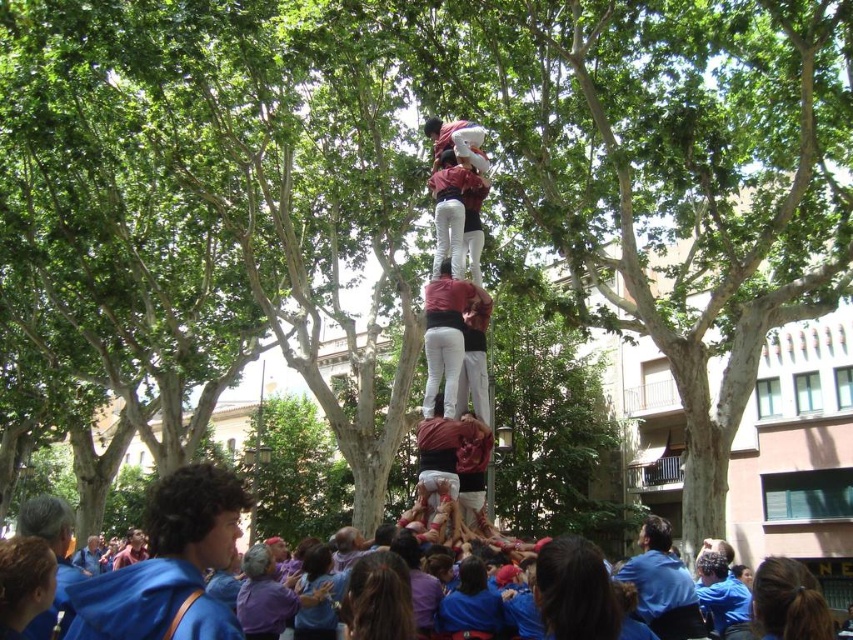
You are an event photographer at the base of the human tower. You need to capture a clear photo of both the smooth white pants at center and the matte red shirt at center. Which object will appear larger in your camera viewfinder?

The smooth white pants at center will appear larger in the camera viewfinder because it is bigger than the matte red shirt at center.

You are a photographer standing at the base of the human tower. You want to take a photo that includes both the smooth white pants at center and the matte red shirt at center. Given that your camera has a maximum focus range of 10 feet, will you need to adjust your position to ensure both are in focus?

The smooth white pants at center is 13.57 feet from matte red shirt at center. Since the distance between them exceeds the camera maximum focus range of 10 feet, you need to move closer to ensure both are within the 10 feet range.

You are a photographer positioned in the public square where the human tower is being built. You want to capture a closeup shot of the highest person in the tower. Which of the two points, point [6,596] or point [457,163], should you focus on to ensure the highest person is in the foreground?

Point [6,596] is closer to the viewer than point [457,163], so focusing on point [6,596] will place the highest person in the foreground.